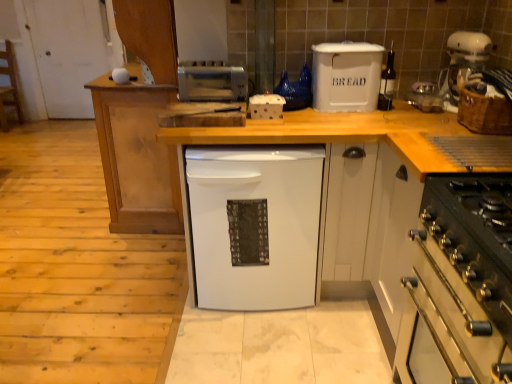
Locate an element on the screen. The width and height of the screenshot is (512, 384). empty space that is to the right of white plastic bread bin at upper center is located at coordinates (398, 114).